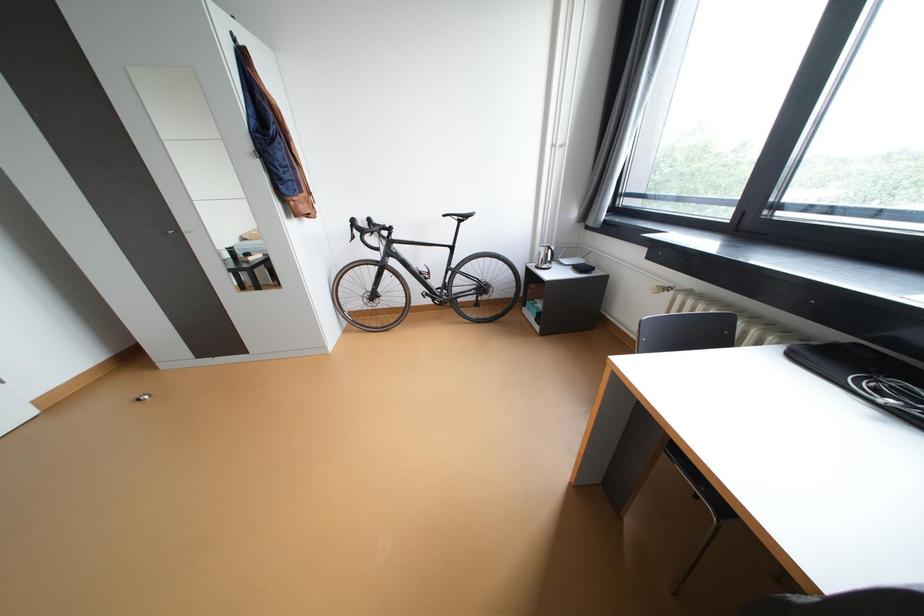
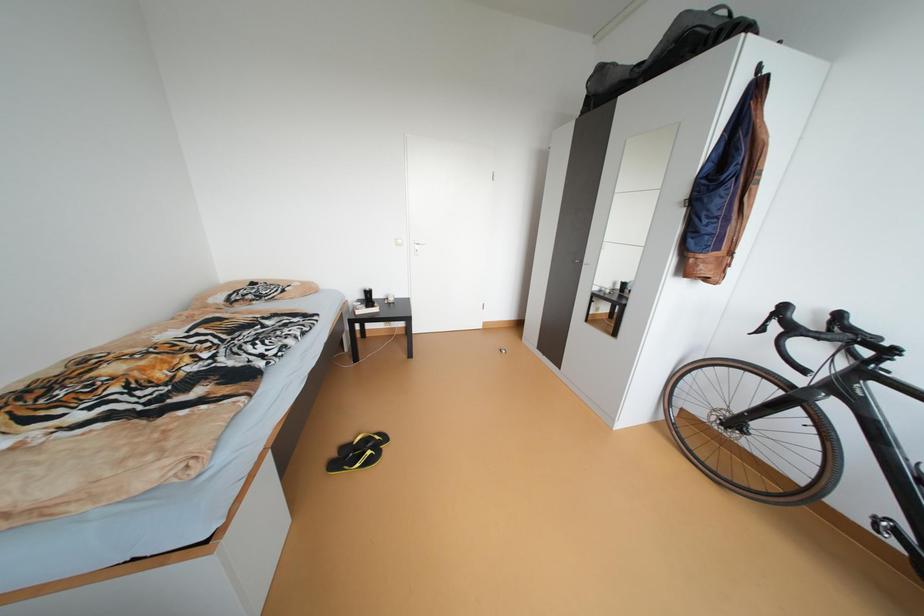
Consider the image. The images are taken continuously from a first-person perspective. In which direction is your viewpoint rotating?

The camera rotated toward left-down.